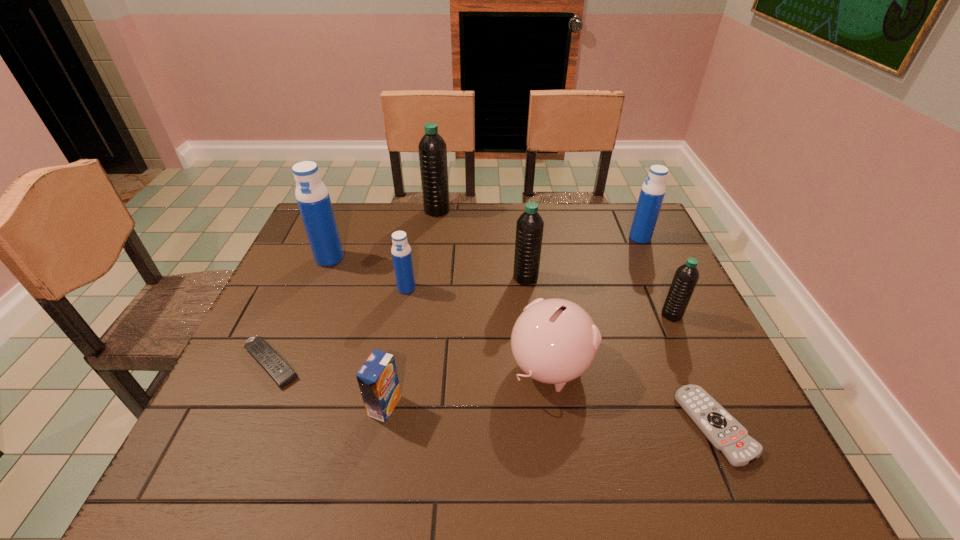
Where is `free space located 0.190m on the front of the rightmost blue water bottle`? free space located 0.190m on the front of the rightmost blue water bottle is located at coordinates (661, 286).

The image size is (960, 540). I want to click on vacant space located 0.290m on the right of the second biggest black water bottle, so click(x=641, y=278).

The image size is (960, 540). What are the coordinates of `vacant area situated 0.160m on the front of the smallest black water bottle` in the screenshot? It's located at (699, 375).

This screenshot has width=960, height=540. I want to click on vacant space situated 0.090m on the right of the second blue water bottle from left to right, so click(448, 288).

The image size is (960, 540). What are the coordinates of `blank space located on the left of the piggy bank` in the screenshot? It's located at (400, 366).

Locate an element on the screen. vacant space situated 0.180m on the right of the eighth tallest object is located at coordinates (485, 406).

The image size is (960, 540). What are the coordinates of `free space located on the front of the left remote control` in the screenshot? It's located at (230, 456).

I want to click on free space located 0.230m on the back of the shortest object, so click(665, 313).

At what (x,y) coordinates should I click in order to perform the action: click on object that is at the near edge. Please return your answer as a coordinate pair (x, y). Looking at the image, I should click on (724, 432).

Where is `water bottle present at the left edge`? The width and height of the screenshot is (960, 540). water bottle present at the left edge is located at coordinates (312, 196).